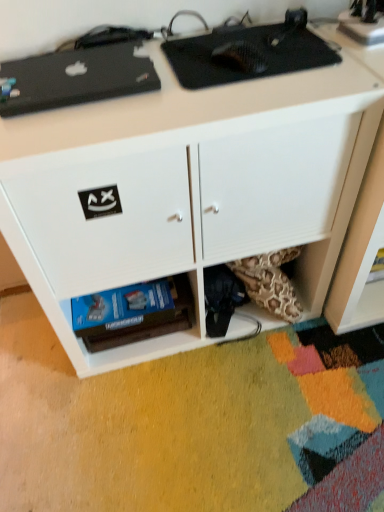
Question: Is black carbon fiber mouse pad at upper center, arranged as the second appliance when viewed from the left, wider than black matte laptop at upper left, positioned as the 1th appliance in left-to-right order?

Choices:
 (A) yes
 (B) no

Answer: (A)

Question: Is black carbon fiber mouse pad at upper center, arranged as the second appliance when viewed from the left, located outside black matte laptop at upper left, the third appliance positioned from the right?

Choices:
 (A) yes
 (B) no

Answer: (A)

Question: Does black carbon fiber mouse pad at upper center, arranged as the second appliance when viewed from the left, appear on the right side of black matte laptop at upper left, positioned as the 1th appliance in left-to-right order?

Choices:
 (A) no
 (B) yes

Answer: (B)

Question: Would you consider black carbon fiber mouse pad at upper center, arranged as the second appliance when viewed from the left, to be distant from black matte laptop at upper left, positioned as the 1th appliance in left-to-right order?

Choices:
 (A) yes
 (B) no

Answer: (B)

Question: Does black carbon fiber mouse pad at upper center, the second appliance in the right-to-left sequence, contain black matte laptop at upper left, positioned as the 1th appliance in left-to-right order?

Choices:
 (A) no
 (B) yes

Answer: (A)

Question: Does black carbon fiber mouse pad at upper center, the second appliance in the right-to-left sequence, have a lesser height compared to black matte laptop at upper left, positioned as the 1th appliance in left-to-right order?

Choices:
 (A) yes
 (B) no

Answer: (A)

Question: Is black matte laptop at upper left, positioned as the 1th appliance in left-to-right order, at the back of metallic silver speaker at upper right, placed as the first appliance when sorted from right to left?

Choices:
 (A) no
 (B) yes

Answer: (A)

Question: Can you confirm if metallic silver speaker at upper right, placed as the first appliance when sorted from right to left, is shorter than black matte laptop at upper left, positioned as the 1th appliance in left-to-right order?

Choices:
 (A) yes
 (B) no

Answer: (B)

Question: Is metallic silver speaker at upper right, the 3th appliance from the left, beside black matte laptop at upper left, the third appliance positioned from the right?

Choices:
 (A) no
 (B) yes

Answer: (A)

Question: Is metallic silver speaker at upper right, the 3th appliance from the left, closer to camera compared to black matte laptop at upper left, positioned as the 1th appliance in left-to-right order?

Choices:
 (A) no
 (B) yes

Answer: (A)

Question: Can you confirm if metallic silver speaker at upper right, placed as the first appliance when sorted from right to left, is thinner than black matte laptop at upper left, positioned as the 1th appliance in left-to-right order?

Choices:
 (A) yes
 (B) no

Answer: (A)

Question: Is metallic silver speaker at upper right, the 3th appliance from the left, not inside black matte laptop at upper left, the third appliance positioned from the right?

Choices:
 (A) no
 (B) yes

Answer: (B)

Question: Considering the relative positions of black matte laptop at upper left, the third appliance positioned from the right, and metallic silver speaker at upper right, the 3th appliance from the left, in the image provided, is black matte laptop at upper left, the third appliance positioned from the right, to the right of metallic silver speaker at upper right, the 3th appliance from the left, from the viewer's perspective?

Choices:
 (A) no
 (B) yes

Answer: (A)